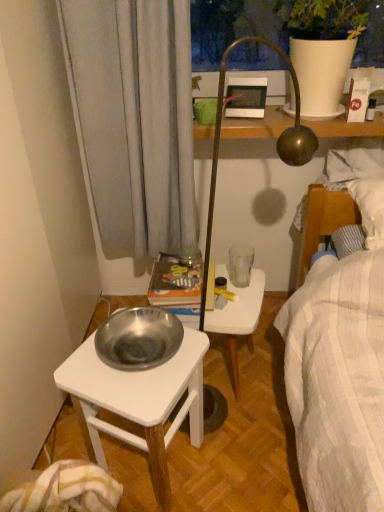
The height and width of the screenshot is (512, 384). I want to click on empty space that is ontop of orange paper book at center (from a real-world perspective), so click(x=179, y=272).